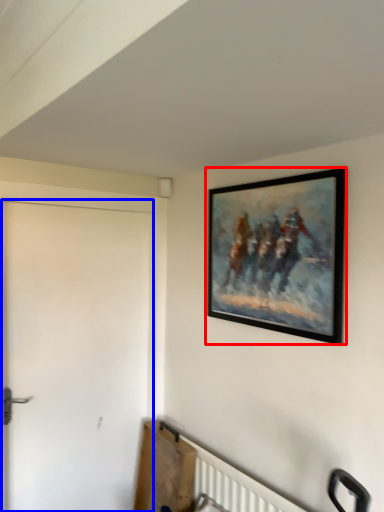
Question: Which point is further to the camera, picture frame (highlighted by a red box) or door (highlighted by a blue box)?

Choices:
 (A) picture frame
 (B) door

Answer: (B)